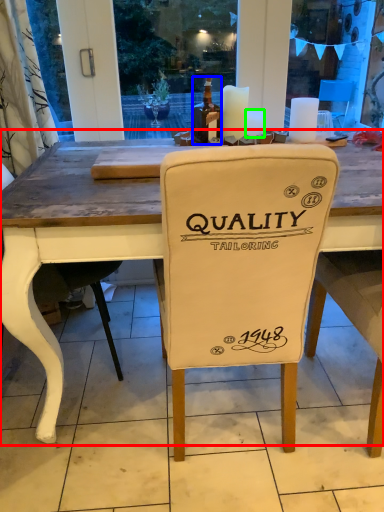
Question: Considering the real-world distances, which object is farthest from table (highlighted by a red box)? bottle (highlighted by a blue box) or candle (highlighted by a green box)?

Choices:
 (A) bottle
 (B) candle

Answer: (B)